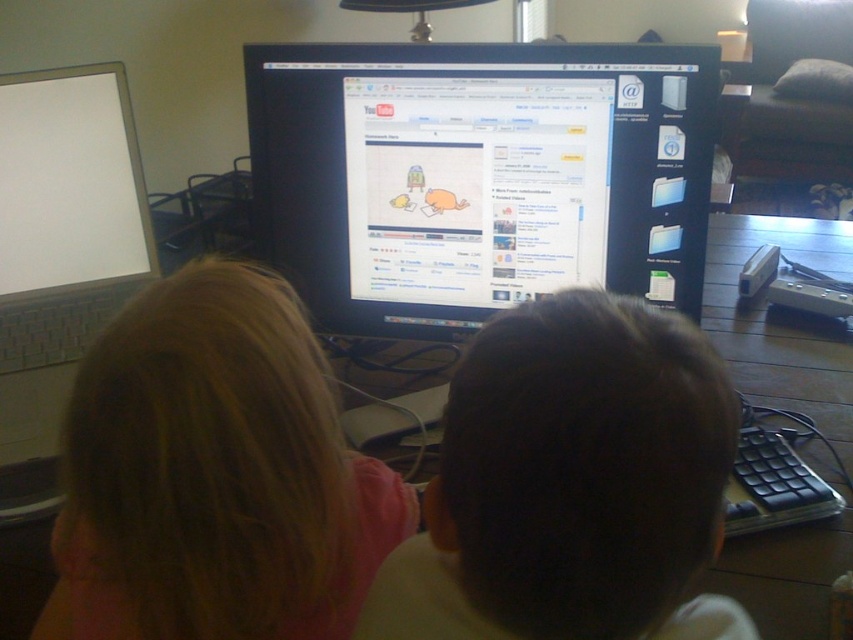
Does black glossy monitor at center lie in front of dark brown hair at center?

No, it is not.

Who is shorter, black glossy monitor at center or dark brown hair at center?

dark brown hair at center is shorter.

Is point (483, 260) more distant than point (578, 488)?

Yes, point (483, 260) is farther from viewer.

Locate an element on the screen. Image resolution: width=853 pixels, height=640 pixels. black glossy monitor at center is located at coordinates (479, 176).

Is black glossy monitor at center above white glossy laptop at left?

Yes, black glossy monitor at center is above white glossy laptop at left.

Can you confirm if black glossy monitor at center is wider than white glossy laptop at left?

Correct, the width of black glossy monitor at center exceeds that of white glossy laptop at left.

Which is behind, point (590, 51) or point (93, 182)?

Point (93, 182)

What are the coordinates of `black glossy monitor at center` in the screenshot? It's located at (479, 176).

Is black glossy monitor at center to the right of blonde hair at upper left from the viewer's perspective?

Yes, black glossy monitor at center is to the right of blonde hair at upper left.

Who is more distant from viewer, [474,298] or [393,525]?

The point [474,298] is behind.

What are the coordinates of `black glossy monitor at center` in the screenshot? It's located at (479, 176).